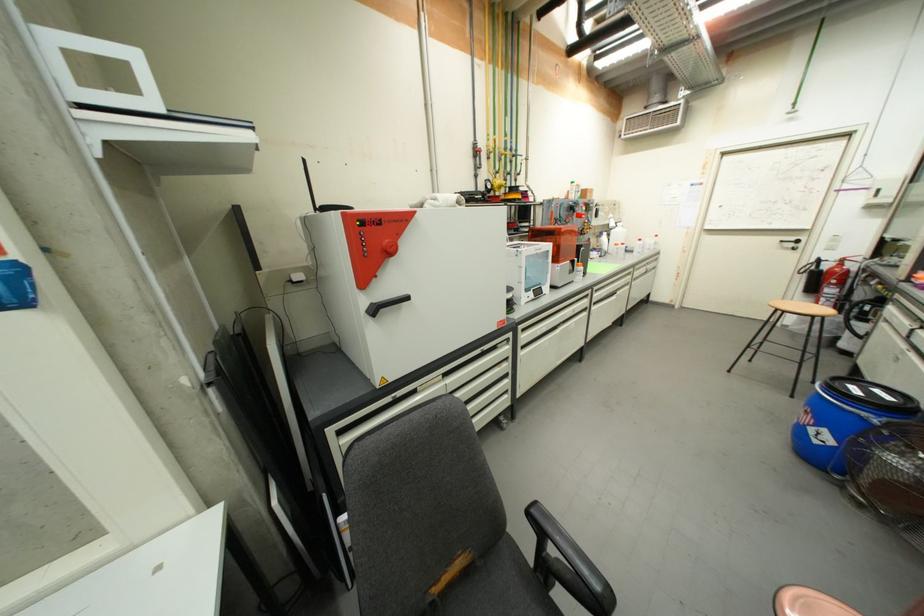
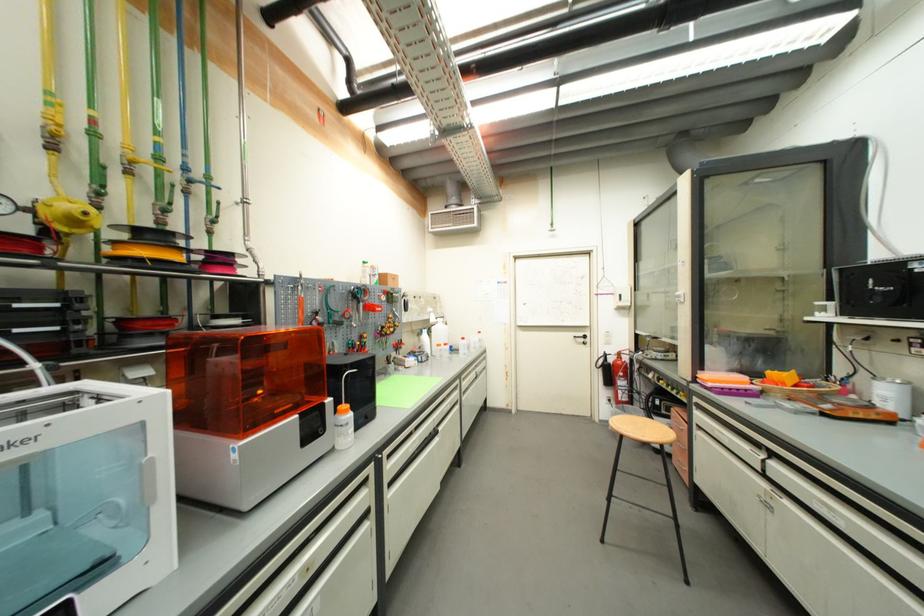
Locate, in the second image, the point that corresponds to (581,261) in the first image.

(334, 402)